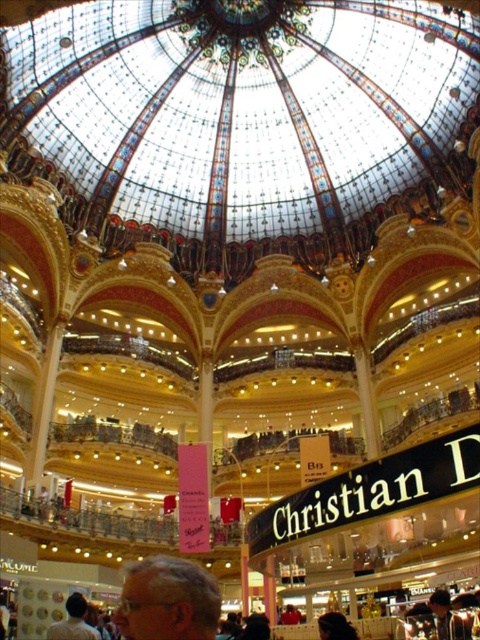
Question: Among these points, which one is nearest to the camera?

Choices:
 (A) (206, 580)
 (B) (84, 618)
 (C) (437, 636)

Answer: (A)

Question: Considering the relative positions of light brown leather jacket at lower left and smooth brown leather jacket at lower right in the image provided, where is light brown leather jacket at lower left located with respect to smooth brown leather jacket at lower right?

Choices:
 (A) right
 (B) left

Answer: (B)

Question: Which is farther from the light brown leather jacket at lower left?

Choices:
 (A) smooth brown leather jacket at lower right
 (B) light brown hair at lower center

Answer: (A)

Question: Which object is closer to the camera taking this photo?

Choices:
 (A) light brown leather jacket at lower left
 (B) smooth brown leather jacket at lower right

Answer: (B)

Question: Can you confirm if light brown hair at lower center is bigger than smooth brown leather jacket at lower right?

Choices:
 (A) yes
 (B) no

Answer: (A)

Question: Does light brown hair at lower center appear over light brown leather jacket at lower left?

Choices:
 (A) no
 (B) yes

Answer: (B)